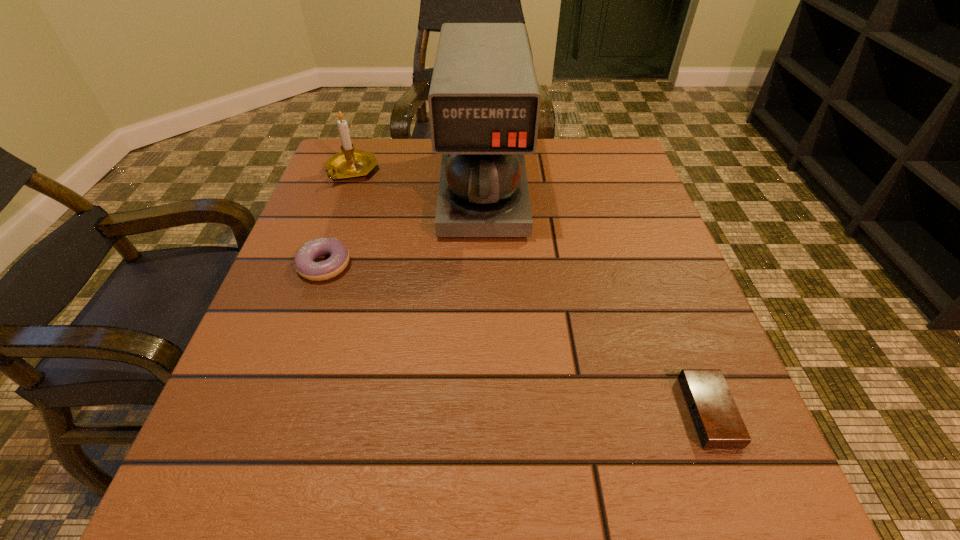
At what (x,y) coordinates should I click in order to perform the action: click on vacant space at the left edge of the desktop. Please return your answer as a coordinate pair (x, y). The image size is (960, 540). Looking at the image, I should click on tap(250, 372).

Where is `vacant position at the right edge of the desktop`? The width and height of the screenshot is (960, 540). vacant position at the right edge of the desktop is located at coordinates (639, 285).

In the image, there is a desktop. Where is `vacant space at the far left corner`? vacant space at the far left corner is located at coordinates [x=377, y=157].

Image resolution: width=960 pixels, height=540 pixels. Find the location of `free space at the near left corner of the desktop`. free space at the near left corner of the desktop is located at coordinates (238, 472).

The height and width of the screenshot is (540, 960). I want to click on free spot at the far right corner of the desktop, so click(x=620, y=177).

Where is `vacant space in between the second shortest object and the second object from right to left`? The height and width of the screenshot is (540, 960). vacant space in between the second shortest object and the second object from right to left is located at coordinates (404, 227).

At what (x,y) coordinates should I click in order to perform the action: click on free space between the coffee maker and the third shortest object. Please return your answer as a coordinate pair (x, y). Looking at the image, I should click on (418, 180).

Locate an element on the screen. This screenshot has height=540, width=960. blank region between the second object from right to left and the third shortest object is located at coordinates (418, 180).

You are a GUI agent. You are given a task and a screenshot of the screen. Output one action in this format:
    pyautogui.click(x=<x>, y=<y>)
    Task: Click on the blank region between the third tallest object and the alarm clock
    
    Given the screenshot: What is the action you would take?
    (516, 339)

Where is `vacant area that lies between the candle holder and the coffee maker`? vacant area that lies between the candle holder and the coffee maker is located at coordinates (418, 180).